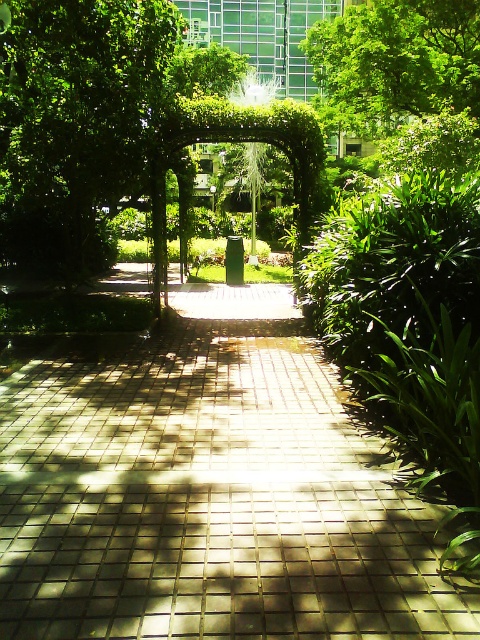
You are a gardener planning to place a large decorative fountain on the brick paved walkway at center. Considering the space available, will the fountain fit if it requires occupying the same area as the green leafy tree at upper center?

The brick paved walkway at center occupies less space than green leafy tree at upper center, so the fountain requiring the space of the green leafy tree at upper center would not fit on the brick paved walkway at center.

You are a gardener who wants to place a 2m wide bench along the brick paved walkway at center. Considering the green leafy tree at center, will the bench fit without blocking the tree?

The brick paved walkway at center is wider than the green leafy tree at center, so placing a 2m wide bench along the walkway would not block the tree as long as it is positioned appropriately within the walkway.

You are standing on the paved pathway and want to take a photo of both the green leafy tree at center and the green leafy tree at upper center. Which tree should you focus on first to ensure both are in clear view?

You should focus on the green leafy tree at upper center first because it is farther away from you than the green leafy tree at center, allowing both to be in clear view when properly focused.